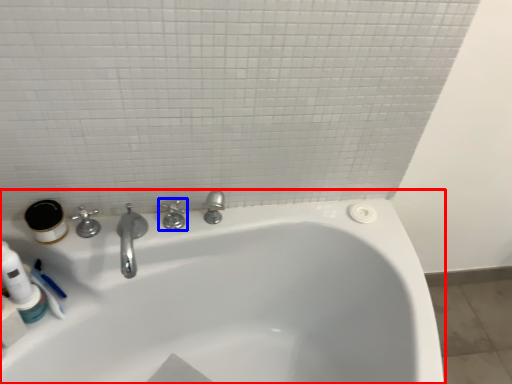
Question: Which of the following is the farthest to the observer, bathtub (highlighted by a red box) or tap (highlighted by a blue box)?

Choices:
 (A) bathtub
 (B) tap

Answer: (B)